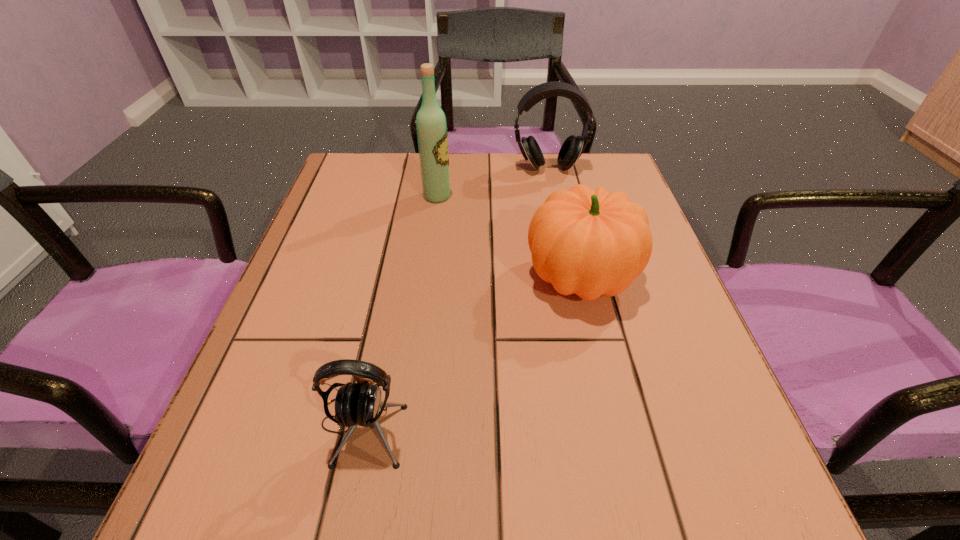
This screenshot has height=540, width=960. In order to click on the tallest object in this screenshot , I will do `click(432, 135)`.

Find the location of a particular element. The image size is (960, 540). the second farthest object is located at coordinates (432, 135).

Locate an element on the screen. The image size is (960, 540). the taller earphone is located at coordinates (572, 148).

Identify the location of the farthest object. The height and width of the screenshot is (540, 960). (572, 148).

Where is `the third farthest object`? The height and width of the screenshot is (540, 960). the third farthest object is located at coordinates (587, 242).

Find the location of `the left earphone`. the left earphone is located at coordinates (359, 403).

You are a GUI agent. You are given a task and a screenshot of the screen. Output one action in this format:
    pyautogui.click(x=<x>, y=<y>)
    Task: Click on the nearest object
    The height and width of the screenshot is (540, 960).
    Given the screenshot: What is the action you would take?
    pyautogui.click(x=359, y=403)

Image resolution: width=960 pixels, height=540 pixels. In order to click on blank space located 0.300m on the front-facing side of the third nearest object in this screenshot , I will do `click(576, 196)`.

The height and width of the screenshot is (540, 960). What are the coordinates of `vacant space situated 0.390m on the ear cups of the right earphone` in the screenshot? It's located at (573, 286).

This screenshot has height=540, width=960. I want to click on free space located 0.150m on the front of the second nearest object, so click(x=609, y=396).